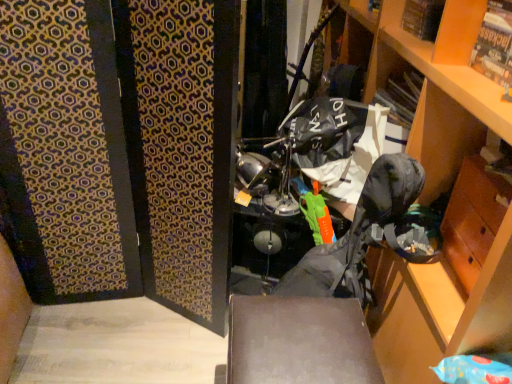
Find the location of a particular element. The width and height of the screenshot is (512, 384). matte cardboard magazine at upper right is located at coordinates (495, 46).

Measure the distance between matte cardboard magazine at upper right and camera.

They are 35.31 inches apart.

Locate an element on the screen. This screenshot has width=512, height=384. wooden cabinet at right is located at coordinates (440, 196).

Are matte cardboard magazine at upper right and wooden drawer at lower right making contact?

matte cardboard magazine at upper right and wooden drawer at lower right are not in contact.

Is matte cardboard magazine at upper right taller or shorter than wooden drawer at lower right?

Considering their sizes, matte cardboard magazine at upper right has less height than wooden drawer at lower right.

Does matte cardboard magazine at upper right turn towards wooden drawer at lower right?

No.

From the image's perspective, which object appears higher, matte cardboard magazine at upper right or wooden drawer at lower right?

matte cardboard magazine at upper right.

In terms of height, does matte black box at center look taller or shorter compared to camouflage fabric folding chair at center?

Considering their sizes, matte black box at center has less height than camouflage fabric folding chair at center.

Between point (283, 362) and point (386, 174), which one is positioned behind?

The point (386, 174) is more distant.

From the image's perspective, which object appears higher, matte black box at center or camouflage fabric folding chair at center?

camouflage fabric folding chair at center, from the image's perspective.

Is matte black box at center positioned with its back to camouflage fabric folding chair at center?

Yes.

Does point (452, 97) lie behind point (502, 204)?

Yes, it is.

From the image's perspective, would you say wooden cabinet at right is positioned over wooden drawer at lower right?

Indeed, from the image's perspective, wooden cabinet at right is shown above wooden drawer at lower right.

Measure the distance between wooden cabinet at right and wooden drawer at lower right.

A distance of 5.22 inches exists between wooden cabinet at right and wooden drawer at lower right.

Which object is further away from the camera taking this photo, wooden cabinet at right or wooden drawer at lower right?

Positioned behind is wooden drawer at lower right.

Is matte cardboard magazine at upper right to the right of matte black box at center from the viewer's perspective?

Yes, matte cardboard magazine at upper right is to the right of matte black box at center.

Considering the sizes of objects matte cardboard magazine at upper right and matte black box at center in the image provided, who is wider, matte cardboard magazine at upper right or matte black box at center?

matte black box at center is wider.

Can you confirm if matte cardboard magazine at upper right is bigger than matte black box at center?

No.

From a real-world perspective, is matte cardboard magazine at upper right physically below matte black box at center?

No, from a real-world perspective, matte cardboard magazine at upper right is not below matte black box at center.

Looking at their sizes, would you say matte cardboard magazine at upper right is wider or thinner than wooden cabinet at right?

matte cardboard magazine at upper right is thinner than wooden cabinet at right.

Does matte cardboard magazine at upper right come in front of wooden cabinet at right?

No.

Is matte cardboard magazine at upper right positioned with its back to wooden cabinet at right?

That's not correct — matte cardboard magazine at upper right is not looking away from wooden cabinet at right.

From the image's perspective, is matte cardboard magazine at upper right above or below wooden cabinet at right?

From the image's perspective, matte cardboard magazine at upper right appears above wooden cabinet at right.

Find the location of a particular element. The width and height of the screenshot is (512, 384). drawer above the camouflage fabric folding chair at center (from a real-world perspective) is located at coordinates (473, 218).

Is wooden drawer at lower right far from camouflage fabric folding chair at center?

Actually, wooden drawer at lower right and camouflage fabric folding chair at center are a little close together.

Can you confirm if wooden drawer at lower right is positioned to the right of camouflage fabric folding chair at center?

Indeed, wooden drawer at lower right is positioned on the right side of camouflage fabric folding chair at center.

Does camouflage fabric folding chair at center have a lesser height compared to matte black box at center?

Incorrect, the height of camouflage fabric folding chair at center does not fall short of that of matte black box at center.

Considering the relative sizes of camouflage fabric folding chair at center and matte black box at center in the image provided, is camouflage fabric folding chair at center thinner than matte black box at center?

Correct, the width of camouflage fabric folding chair at center is less than that of matte black box at center.

Is camouflage fabric folding chair at center oriented away from matte black box at center?

No.

Image resolution: width=512 pixels, height=384 pixels. In order to click on magazine in front of the wooden drawer at lower right in this screenshot , I will do `click(495, 46)`.

Where is `furniture on the left of camouflage fabric folding chair at center`? The width and height of the screenshot is (512, 384). furniture on the left of camouflage fabric folding chair at center is located at coordinates (298, 342).

Which object lies nearer to the anchor point matte black box at center, matte cardboard magazine at upper right or wooden cabinet at right?

wooden cabinet at right is positioned closer to the anchor matte black box at center.

When comparing their distances from wooden cabinet at right, does matte black box at center or matte cardboard magazine at upper right seem closer?

matte cardboard magazine at upper right is positioned closer to the anchor wooden cabinet at right.

Estimate the real-world distances between objects in this image. Which object is further from matte black box at center, wooden drawer at lower right or wooden cabinet at right?

Among the two, wooden drawer at lower right is located further to matte black box at center.

From the image, which object appears to be nearer to wooden drawer at lower right, wooden cabinet at right or matte black box at center?

wooden cabinet at right is positioned closer to the anchor wooden drawer at lower right.

Which object lies further to the anchor point wooden cabinet at right, wooden drawer at lower right or camouflage fabric folding chair at center?

Among the two, camouflage fabric folding chair at center is located further to wooden cabinet at right.

Based on their spatial positions, is wooden cabinet at right or matte black box at center closer to camouflage fabric folding chair at center?

matte black box at center is closer to camouflage fabric folding chair at center.

Looking at the image, which one is located closer to matte cardboard magazine at upper right, wooden drawer at lower right or camouflage fabric folding chair at center?

Among the two, wooden drawer at lower right is located nearer to matte cardboard magazine at upper right.

Looking at the image, which one is located further to wooden cabinet at right, matte cardboard magazine at upper right or matte black box at center?

The object further to wooden cabinet at right is matte black box at center.

Locate an element on the screen. drawer between wooden cabinet at right and camouflage fabric folding chair at center in the front-back direction is located at coordinates (473, 218).

What are the coordinates of `folding chair that lies between matte cardboard magazine at upper right and matte black box at center from top to bottom` in the screenshot? It's located at (298, 343).

You are a GUI agent. You are given a task and a screenshot of the screen. Output one action in this format:
    pyautogui.click(x=<x>, y=<y>)
    Task: Click on the drawer between matte cardboard magazine at upper right and camouflage fabric folding chair at center vertically
    The width and height of the screenshot is (512, 384).
    Given the screenshot: What is the action you would take?
    pyautogui.click(x=473, y=218)

Locate an element on the screen. folding chair between wooden cabinet at right and matte black box at center from top to bottom is located at coordinates (298, 343).